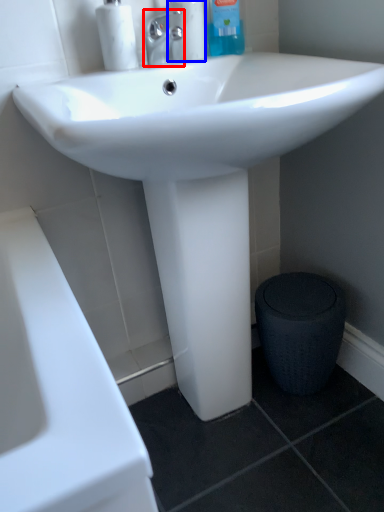
Question: Which object is further to the camera taking this photo, tap (highlighted by a red box) or cleaning product (highlighted by a blue box)?

Choices:
 (A) tap
 (B) cleaning product

Answer: (B)